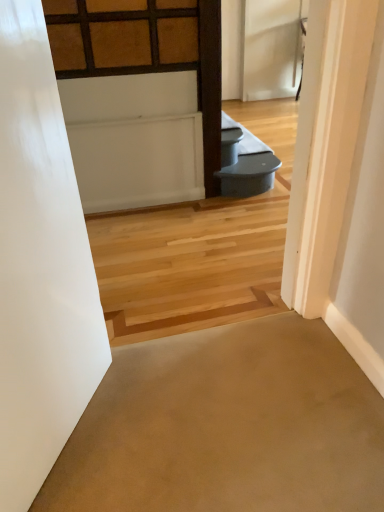
What do you see at coordinates (40, 267) in the screenshot?
I see `white glossy door at left` at bounding box center [40, 267].

I want to click on white glossy door at left, so click(x=40, y=267).

Find the location of a particular element. Image resolution: width=384 pixels, height=512 pixels. white glossy door at left is located at coordinates (40, 267).